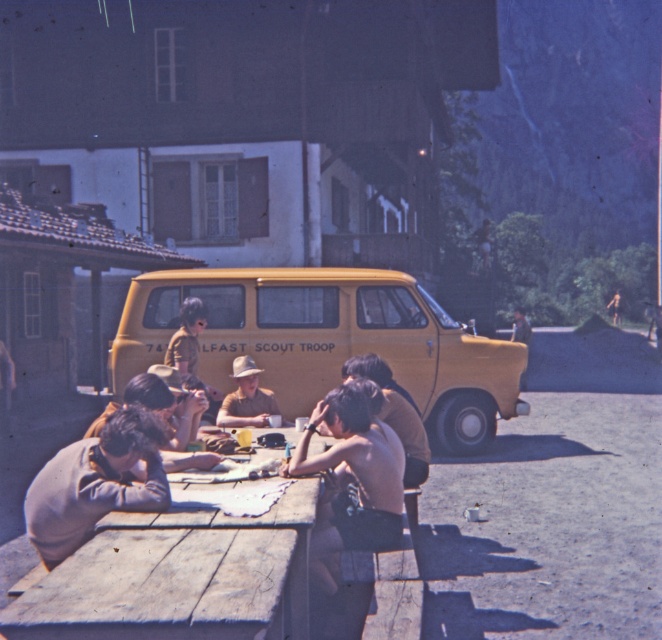
Does light brown sweater at lower left have a smaller size compared to matte khaki hat at center?

Correct, light brown sweater at lower left occupies less space than matte khaki hat at center.

Is point (79, 465) positioned after point (246, 410)?

No, it is in front of (246, 410).

Identify the location of light brown sweater at lower left. Image resolution: width=662 pixels, height=640 pixels. (95, 483).

Between point (461, 452) and point (144, 490), which one is positioned in front?

Point (144, 490) is more forward.

Between yellow matte van at center and light brown sweater at lower left, which one appears on the right side from the viewer's perspective?

Positioned to the right is yellow matte van at center.

Between point (393, 328) and point (83, 536), which one is positioned behind?

Point (393, 328)

Find the location of a particular element. yellow matte van at center is located at coordinates (326, 340).

Can you confirm if wooden table at lower center is positioned above light brown sweater at lower left?

No.

Is wooden table at lower center to the left of light brown sweater at lower left from the viewer's perspective?

No, wooden table at lower center is not to the left of light brown sweater at lower left.

Is point (281, 512) positioned behind point (89, 474)?

Yes, point (281, 512) is behind point (89, 474).

Image resolution: width=662 pixels, height=640 pixels. I want to click on wooden table at lower center, so click(x=179, y=577).